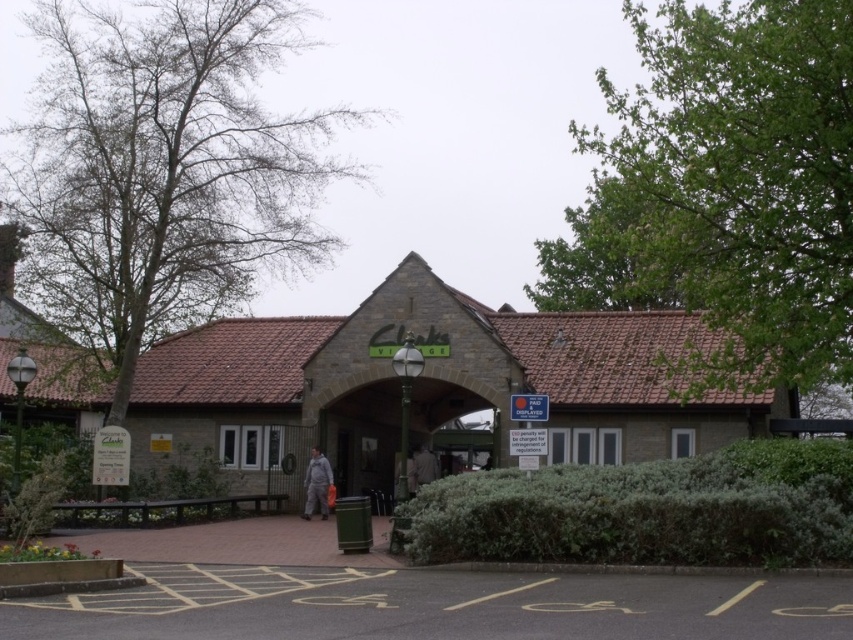
Which is below, green leafy hedge at lower center or metallic gate at center?

green leafy hedge at lower center is below.

Between point (494, 541) and point (419, 394), which one is positioned in front?

Point (494, 541) is more forward.

I want to click on green leafy hedge at lower center, so click(647, 509).

How distant is metallic gate at center from light brown leather jacket at center?

They are 12.79 feet apart.

Who is positioned more to the left, metallic gate at center or light brown leather jacket at center?

light brown leather jacket at center

You are a GUI agent. You are given a task and a screenshot of the screen. Output one action in this format:
    pyautogui.click(x=<x>, y=<y>)
    Task: Click on the metallic gate at center
    
    Given the screenshot: What is the action you would take?
    pyautogui.click(x=363, y=433)

Is point (579, 499) positioned behind point (428, 483)?

No, (579, 499) is closer to viewer.

Which is behind, point (798, 497) or point (421, 477)?

Positioned behind is point (421, 477).

Who is more forward, (552, 506) or (428, 481)?

Point (552, 506) is more forward.

This screenshot has width=853, height=640. Find the location of `green leafy hedge at lower center`. green leafy hedge at lower center is located at coordinates (647, 509).